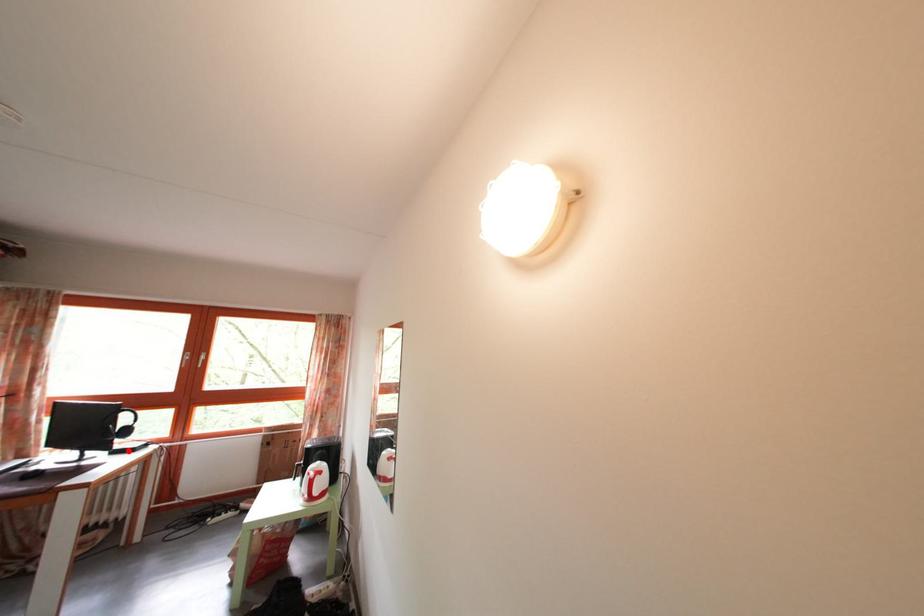
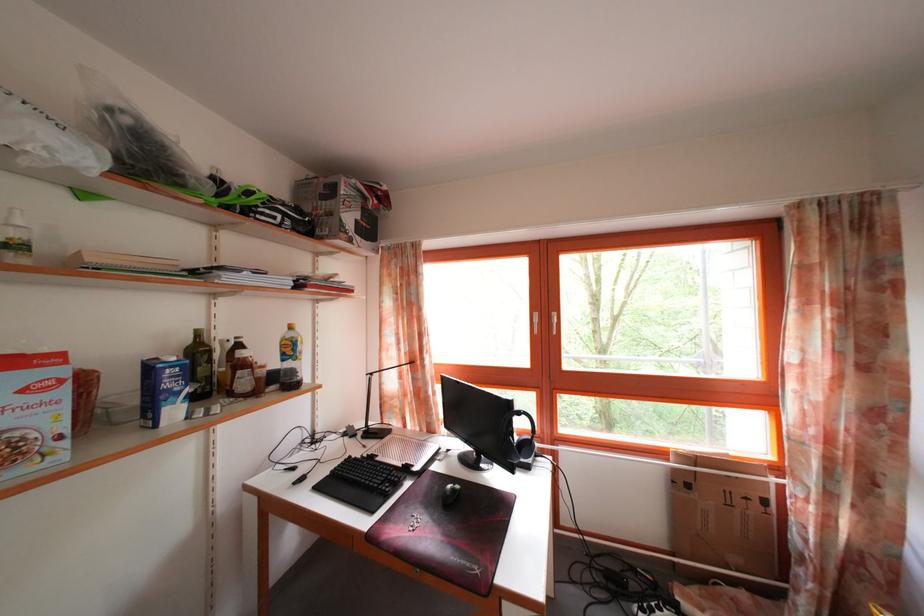
Question: A red point is marked in image1. In image2, is the corresponding 3D point closer to the camera or farther? Reply with the corresponding letter.

Choices:
 (A) The corresponding 3D point is closer.
 (B) The corresponding 3D point is farther.

Answer: (B)